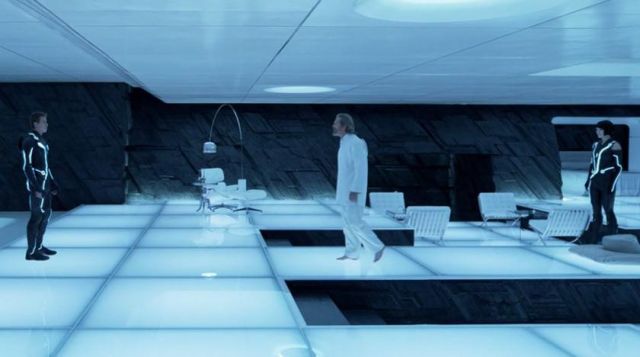
You are a GUI agent. You are given a task and a screenshot of the screen. Output one action in this format:
    pyautogui.click(x=<x>, y=<y>)
    Task: Click on the white flooring
    The image size is (640, 357).
    Given the screenshot: What is the action you would take?
    pyautogui.click(x=244, y=323)